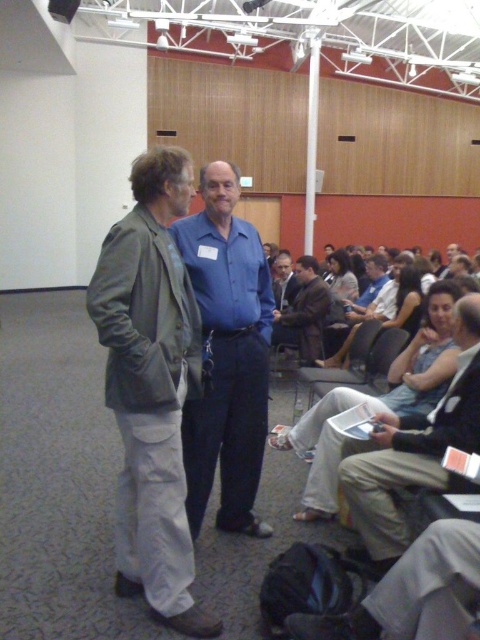
Question: Which point appears closest to the camera in this image?

Choices:
 (A) (320, 289)
 (B) (360, 452)
 (C) (405, 269)
 (D) (236, 474)

Answer: (D)

Question: Observing the image, what is the correct spatial positioning of blue smooth shirt at center in reference to matte black dress at center?

Choices:
 (A) right
 (B) left

Answer: (B)

Question: Is blue smooth shirt at center below matte black dress at center?

Choices:
 (A) yes
 (B) no

Answer: (A)

Question: Which is nearer to the matte blue shirt at center?

Choices:
 (A) matte black dress at center
 (B) khaki cotton pants at lower right
 (C) leather jacket at center

Answer: (A)

Question: Can you confirm if blue smooth shirt at center is bigger than khaki cotton pants at lower right?

Choices:
 (A) yes
 (B) no

Answer: (A)

Question: Which point is farther to the camera?

Choices:
 (A) khaki cotton pants at lower right
 (B) leather jacket at center
 (C) matte blue shirt at center
 (D) light blue shirt at center

Answer: (D)